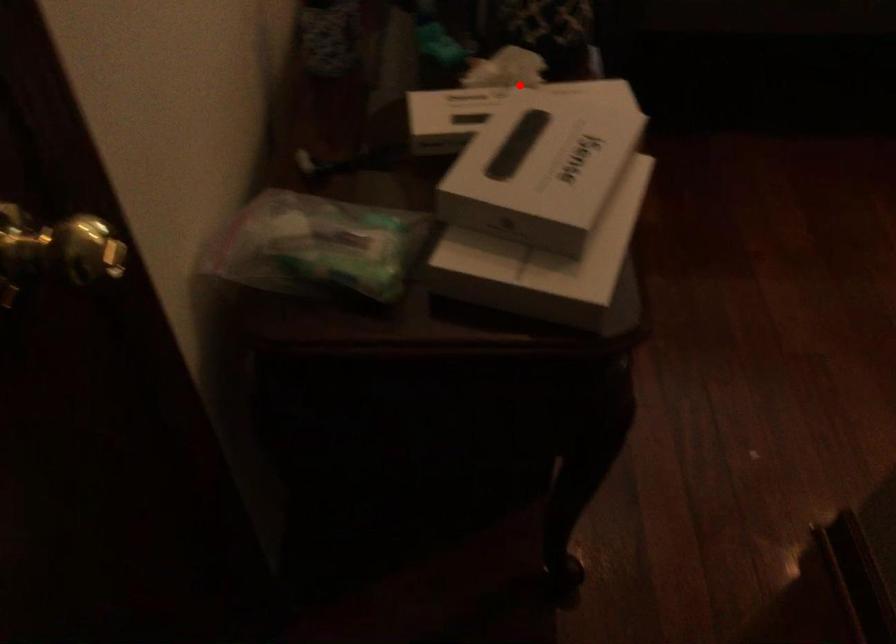
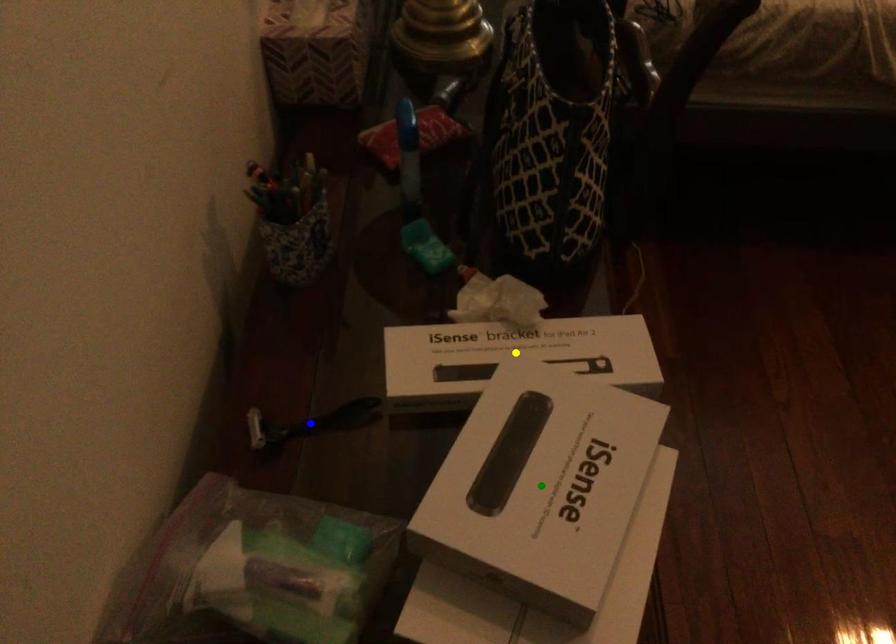
Question: I am providing you with two images of the same scene from different viewpoints. A red point is marked on the first image. You are given multiple points on the second image. Can you choose the point in image 2 that corresponds to the point in image 1?

Choices:
 (A) green point
 (B) yellow point
 (C) blue point

Answer: (B)